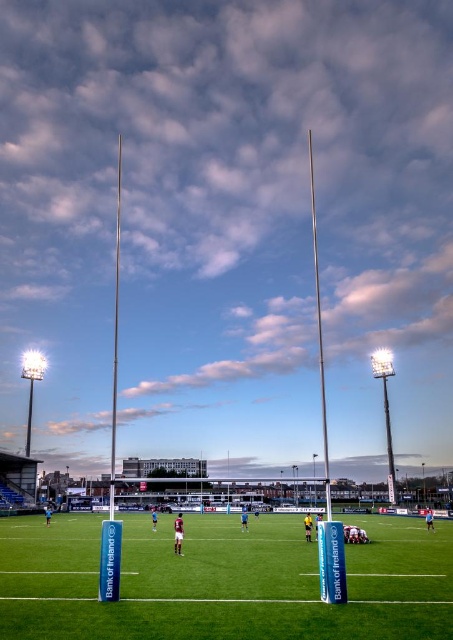
You are standing at the origin point of the coordinate system. Where is the green grass field at center located in terms of coordinates?

The green grass field at center is located at coordinates point (222,580).

You are a photographer standing at the edge of the rugby field. You want to take a picture of the green grass field at center and the silver metallic pole at left. Which object should appear closer to the camera in the photo?

The green grass field at center appears closer to the camera because it is in front of the silver metallic pole at left.